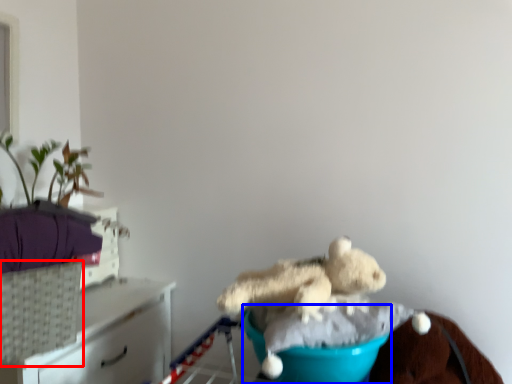
Question: Among these objects, which one is nearest to the camera, basket (highlighted by a red box) or teal (highlighted by a blue box)?

Choices:
 (A) basket
 (B) teal

Answer: (B)